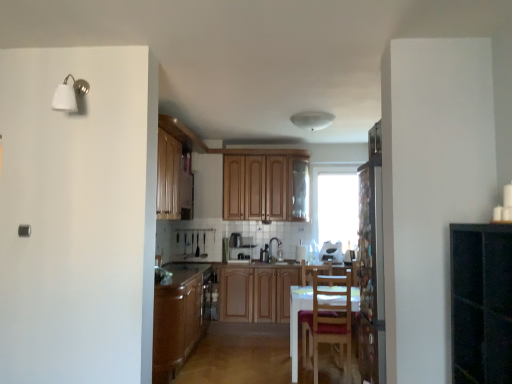
Question: Is point (185, 301) closer or farther from the camera than point (354, 213)?

Choices:
 (A) farther
 (B) closer

Answer: (B)

Question: Looking at the image, does brown wood cabinet at center, which is the 2th cabinetry in top-to-bottom order, seem bigger or smaller compared to transparent glass window at center?

Choices:
 (A) big
 (B) small

Answer: (A)

Question: Estimate the real-world distances between objects in this image. Which object is farther from the brown wood cabinet at center, the first cabinetry when ordered from left to right?

Choices:
 (A) transparent glass window at center
 (B) matte brown countertop at lower center
 (C) satin silver toaster at center, arranged as the 3th appliance when viewed from the right
 (D) wooden chair at center
 (E) wooden cabinets at center, the second cabinetry in the bottom-to-top sequence

Answer: (A)

Question: Based on their relative distances, which object is nearer to the white glossy toaster at center, which is counted as the 1th appliance, starting from the right?

Choices:
 (A) wooden cabinet at center, which is the second appliance from right to left
 (B) matte brown countertop at lower center
 (C) satin silver toaster at center, the first appliance when ordered from left to right
 (D) wooden chair at center
 (E) brown wood cabinet at center, the second cabinetry viewed from the right

Answer: (A)